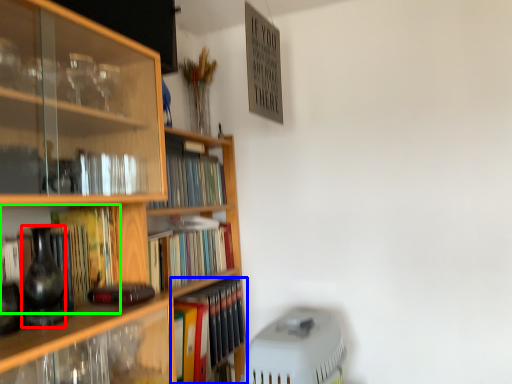
Question: Which object is the farthest from glass vase (highlighted by a red box)? Choose among these: book (highlighted by a blue box) or book (highlighted by a green box).

Choices:
 (A) book
 (B) book

Answer: (A)